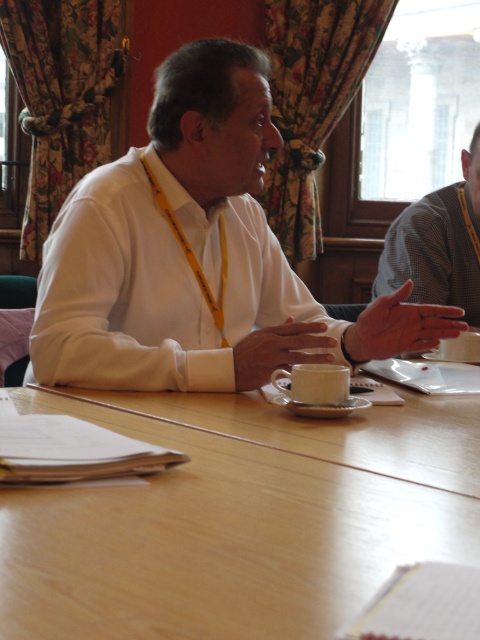
You are organizing a small gathering and need to place a 15 cm wide decorative plate on the table. Based on the scene, can the wooden table at center accommodate the white matte cup at center and the new plate without overlapping?

The wooden table at center is wider than the white matte cup at center, so it can accommodate both the cup and the new plate without overlapping.

You are organizing a small meeting and need to seat two people comfortably at the wooden table at center. Considering the gray checkered shirt at right is worn by a person sitting at the table, will the table be wide enough to accommodate both attendees comfortably?

The wooden table at center is wider than the gray checkered shirt at right, so yes, the table should be wide enough to accommodate both attendees comfortably.